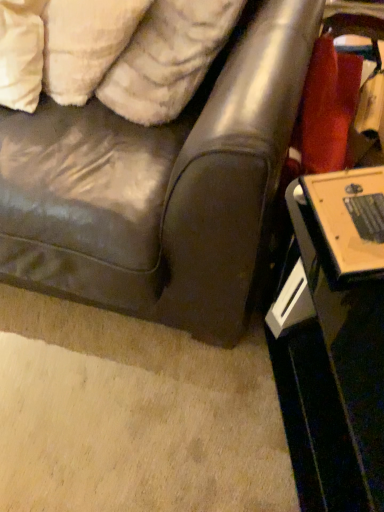
Describe the element at coordinates (85, 44) in the screenshot. The height and width of the screenshot is (512, 384). I see `white fluffy pillow at upper left, which ranks as the 2th pillow in right-to-left order` at that location.

The image size is (384, 512). What are the coordinates of `white fluffy pillow at upper left, which ranks as the 2th pillow in right-to-left order` in the screenshot? It's located at (85, 44).

Find the location of `leather couch at center`. leather couch at center is located at coordinates (160, 190).

Describe the element at coordinates (160, 190) in the screenshot. The image size is (384, 512). I see `leather couch at center` at that location.

This screenshot has height=512, width=384. Describe the element at coordinates (333, 339) in the screenshot. I see `black glossy table at lower right` at that location.

This screenshot has width=384, height=512. I want to click on white fluffy pillow at upper left, the second pillow from the left, so click(167, 58).

Are leather couch at center and black glossy table at lower right far apart?

No, there isn't a large distance between leather couch at center and black glossy table at lower right.

From a real-world perspective, is leather couch at center on top of black glossy table at lower right?

Yes, from a real-world perspective, leather couch at center is above black glossy table at lower right.

From the image's perspective, between leather couch at center and black glossy table at lower right, who is located below?

black glossy table at lower right, from the image's perspective.

Considering the sizes of leather couch at center and black glossy table at lower right in the image, is leather couch at center taller or shorter than black glossy table at lower right?

In the image, leather couch at center appears to be taller than black glossy table at lower right.

Does black glossy table at lower right come in front of white fluffy pillow at upper left, which is the 1th pillow in left-to-right order?

That is True.

Could you tell me if black glossy table at lower right is facing white fluffy pillow at upper left, which ranks as the 2th pillow in right-to-left order?

No, black glossy table at lower right is not turned towards white fluffy pillow at upper left, which ranks as the 2th pillow in right-to-left order.

What's the angular difference between black glossy table at lower right and white fluffy pillow at upper left, which ranks as the 2th pillow in right-to-left order,'s facing directions?

29.9 degrees separate the facing orientations of black glossy table at lower right and white fluffy pillow at upper left, which ranks as the 2th pillow in right-to-left order.

Looking at this image, is black glossy table at lower right shorter than white fluffy pillow at upper left, which is the 1th pillow in left-to-right order?

In fact, black glossy table at lower right may be taller than white fluffy pillow at upper left, which is the 1th pillow in left-to-right order.

Is white fluffy pillow at upper left, which is the 1th pillow in left-to-right order, oriented towards black glossy table at lower right?

No, white fluffy pillow at upper left, which is the 1th pillow in left-to-right order, is not aimed at black glossy table at lower right.

Can you confirm if white fluffy pillow at upper left, which is the 1th pillow in left-to-right order, is wider than black glossy table at lower right?

Incorrect, the width of white fluffy pillow at upper left, which is the 1th pillow in left-to-right order, does not surpass that of black glossy table at lower right.

From the image's perspective, who appears lower, white fluffy pillow at upper left, which is the 1th pillow in left-to-right order, or black glossy table at lower right?

black glossy table at lower right.

Can you see white fluffy pillow at upper left, which is the 1th pillow in left-to-right order, touching black glossy table at lower right?

white fluffy pillow at upper left, which is the 1th pillow in left-to-right order, and black glossy table at lower right are clearly separated.

Considering the positions of points (329, 183) and (178, 9), is point (329, 183) closer to camera compared to point (178, 9)?

Yes.

Considering the sizes of objects black glossy table at lower right and white fluffy pillow at upper left, which is the 1th pillow in right-to-left order, in the image provided, who is thinner, black glossy table at lower right or white fluffy pillow at upper left, which is the 1th pillow in right-to-left order,?

white fluffy pillow at upper left, which is the 1th pillow in right-to-left order, is thinner.

Does black glossy table at lower right have a smaller size compared to white fluffy pillow at upper left, which is the 1th pillow in right-to-left order?

Actually, black glossy table at lower right might be larger than white fluffy pillow at upper left, which is the 1th pillow in right-to-left order.

From a real-world perspective, is black glossy table at lower right below white fluffy pillow at upper left, which is the 1th pillow in right-to-left order?

Yes, from a real-world perspective, black glossy table at lower right is below white fluffy pillow at upper left, which is the 1th pillow in right-to-left order.

Is white fluffy pillow at upper left, which is the 1th pillow in right-to-left order, aimed at leather couch at center?

Yes.

From the image's perspective, is white fluffy pillow at upper left, the second pillow from the left, beneath leather couch at center?

Incorrect, from the image's perspective, white fluffy pillow at upper left, the second pillow from the left, is higher than leather couch at center.

Which object is further away from the camera, white fluffy pillow at upper left, the second pillow from the left, or leather couch at center?

white fluffy pillow at upper left, the second pillow from the left, is more distant.

Starting from the leather couch at center, which pillow is the 2nd one to the right? Please provide its 2D coordinates.

[(167, 58)]

Which of these two, white fluffy pillow at upper left, which is the 1th pillow in left-to-right order, or leather couch at center, is wider?

With larger width is leather couch at center.

Is white fluffy pillow at upper left, which ranks as the 2th pillow in right-to-left order, placed right next to leather couch at center?

No, white fluffy pillow at upper left, which ranks as the 2th pillow in right-to-left order, is not in contact with leather couch at center.

Considering the relative sizes of white fluffy pillow at upper left, which is the 1th pillow in left-to-right order, and leather couch at center in the image provided, is white fluffy pillow at upper left, which is the 1th pillow in left-to-right order, shorter than leather couch at center?

Indeed, white fluffy pillow at upper left, which is the 1th pillow in left-to-right order, has a lesser height compared to leather couch at center.

Do you think white fluffy pillow at upper left, which ranks as the 2th pillow in right-to-left order, is within leather couch at center, or outside of it?

white fluffy pillow at upper left, which ranks as the 2th pillow in right-to-left order, fits inside leather couch at center.

Considering the sizes of white fluffy pillow at upper left, which is the 1th pillow in right-to-left order, and white fluffy pillow at upper left, which ranks as the 2th pillow in right-to-left order, in the image, is white fluffy pillow at upper left, which is the 1th pillow in right-to-left order, taller or shorter than white fluffy pillow at upper left, which ranks as the 2th pillow in right-to-left order,?

white fluffy pillow at upper left, which is the 1th pillow in right-to-left order, is taller than white fluffy pillow at upper left, which ranks as the 2th pillow in right-to-left order.

Can you confirm if white fluffy pillow at upper left, which is the 1th pillow in right-to-left order, is bigger than white fluffy pillow at upper left, which ranks as the 2th pillow in right-to-left order?

Yes, white fluffy pillow at upper left, which is the 1th pillow in right-to-left order, is bigger than white fluffy pillow at upper left, which ranks as the 2th pillow in right-to-left order.

Which point is more distant from viewer, [117,106] or [67,74]?

The point [67,74] is more distant.

The image size is (384, 512). In the image, there is a leather couch at center. In order to click on table below it (from the image's perspective) in this screenshot , I will do tap(333, 339).

You are a GUI agent. You are given a task and a screenshot of the screen. Output one action in this format:
    pyautogui.click(x=<x>, y=<y>)
    Task: Click on the table that appears on the right of white fluffy pillow at upper left, which ranks as the 2th pillow in right-to-left order
    This screenshot has width=384, height=512.
    Given the screenshot: What is the action you would take?
    pyautogui.click(x=333, y=339)

From the image, which object appears to be nearer to leather couch at center, white fluffy pillow at upper left, which ranks as the 2th pillow in right-to-left order, or black glossy table at lower right?

black glossy table at lower right lies closer to leather couch at center than the other object.

When comparing their distances from black glossy table at lower right, does white fluffy pillow at upper left, which ranks as the 2th pillow in right-to-left order, or white fluffy pillow at upper left, the second pillow from the left, seem further?

white fluffy pillow at upper left, which ranks as the 2th pillow in right-to-left order, is positioned further to the anchor black glossy table at lower right.

When comparing their distances from white fluffy pillow at upper left, which is the 1th pillow in left-to-right order, does white fluffy pillow at upper left, the second pillow from the left, or leather couch at center seem closer?

white fluffy pillow at upper left, the second pillow from the left, is positioned closer to the anchor white fluffy pillow at upper left, which is the 1th pillow in left-to-right order.

Estimate the real-world distances between objects in this image. Which object is closer to white fluffy pillow at upper left, which is the 1th pillow in left-to-right order, black glossy table at lower right or leather couch at center?

leather couch at center lies closer to white fluffy pillow at upper left, which is the 1th pillow in left-to-right order, than the other object.

When comparing their distances from white fluffy pillow at upper left, the second pillow from the left, does leather couch at center or white fluffy pillow at upper left, which ranks as the 2th pillow in right-to-left order, seem further?

Among the two, leather couch at center is located further to white fluffy pillow at upper left, the second pillow from the left.

Estimate the real-world distances between objects in this image. Which object is closer to black glossy table at lower right, white fluffy pillow at upper left, which is the 1th pillow in right-to-left order, or leather couch at center?

leather couch at center.

Which object lies nearer to the anchor point leather couch at center, white fluffy pillow at upper left, which is the 1th pillow in right-to-left order, or white fluffy pillow at upper left, which ranks as the 2th pillow in right-to-left order?

white fluffy pillow at upper left, which is the 1th pillow in right-to-left order, lies closer to leather couch at center than the other object.

Based on their spatial positions, is black glossy table at lower right or white fluffy pillow at upper left, which is the 1th pillow in right-to-left order, further from white fluffy pillow at upper left, which ranks as the 2th pillow in right-to-left order?

Based on the image, black glossy table at lower right appears to be further to white fluffy pillow at upper left, which ranks as the 2th pillow in right-to-left order.

At what (x,y) coordinates should I click in order to perform the action: click on studio couch that lies between white fluffy pillow at upper left, the second pillow from the left, and black glossy table at lower right from top to bottom. Please return your answer as a coordinate pair (x, y). Looking at the image, I should click on (160, 190).

Find the location of a particular element. The height and width of the screenshot is (512, 384). pillow located between leather couch at center and white fluffy pillow at upper left, which is the 1th pillow in left-to-right order, in the depth direction is located at coordinates (167, 58).

Image resolution: width=384 pixels, height=512 pixels. In order to click on pillow that lies between white fluffy pillow at upper left, which is the 1th pillow in left-to-right order, and black glossy table at lower right from top to bottom in this screenshot , I will do `click(167, 58)`.